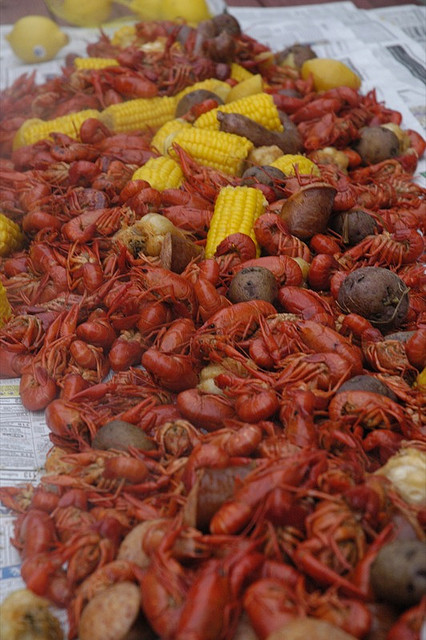
The width and height of the screenshot is (426, 640). What are the coordinates of `newspaper` in the screenshot? It's located at [x=393, y=64].